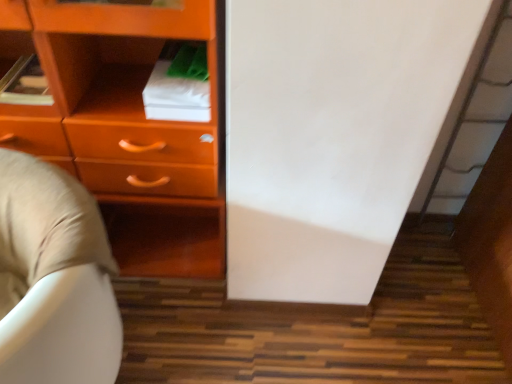
Question: Is beige fabric bean bag chair at lower left inside matte orange chest of drawers at left?

Choices:
 (A) yes
 (B) no

Answer: (B)

Question: Is matte orange chest of drawers at left smaller than beige fabric bean bag chair at lower left?

Choices:
 (A) no
 (B) yes

Answer: (A)

Question: Is matte orange chest of drawers at left further to the viewer compared to beige fabric bean bag chair at lower left?

Choices:
 (A) no
 (B) yes

Answer: (B)

Question: Can you confirm if matte orange chest of drawers at left is taller than beige fabric bean bag chair at lower left?

Choices:
 (A) no
 (B) yes

Answer: (B)

Question: Is matte orange chest of drawers at left in contact with beige fabric bean bag chair at lower left?

Choices:
 (A) no
 (B) yes

Answer: (A)

Question: Is matte orange chest of drawers at left positioned far away from beige fabric bean bag chair at lower left?

Choices:
 (A) yes
 (B) no

Answer: (B)

Question: From the image's perspective, does beige fabric bean bag chair at lower left appear higher than matte orange chest of drawers at left?

Choices:
 (A) yes
 (B) no

Answer: (B)

Question: Considering the relative sizes of beige fabric bean bag chair at lower left and matte orange chest of drawers at left in the image provided, is beige fabric bean bag chair at lower left bigger than matte orange chest of drawers at left?

Choices:
 (A) no
 (B) yes

Answer: (A)

Question: Is beige fabric bean bag chair at lower left shorter than matte orange chest of drawers at left?

Choices:
 (A) no
 (B) yes

Answer: (B)

Question: Is the depth of beige fabric bean bag chair at lower left less than that of matte orange chest of drawers at left?

Choices:
 (A) yes
 (B) no

Answer: (A)

Question: Would you say beige fabric bean bag chair at lower left contains matte orange chest of drawers at left?

Choices:
 (A) yes
 (B) no

Answer: (B)

Question: Does beige fabric bean bag chair at lower left touch matte orange chest of drawers at left?

Choices:
 (A) yes
 (B) no

Answer: (B)

Question: Would you say matte orange chest of drawers at left is to the left or to the right of beige fabric bean bag chair at lower left in the picture?

Choices:
 (A) left
 (B) right

Answer: (B)